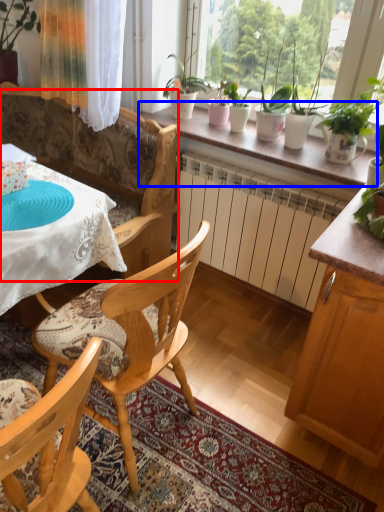
Question: Which point is further to the camera, couch (highlighted by a red box) or window sill (highlighted by a blue box)?

Choices:
 (A) couch
 (B) window sill

Answer: (B)